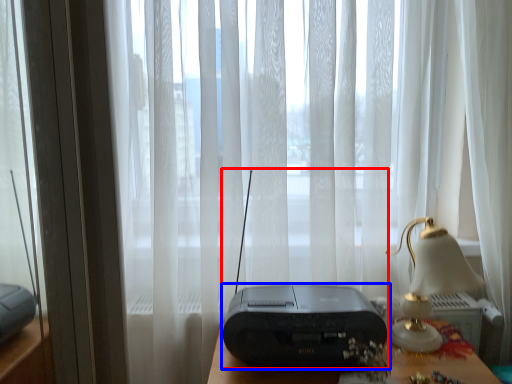
Question: Among these objects, which one is farthest to the camera, gadget (highlighted by a red box) or printer (highlighted by a blue box)?

Choices:
 (A) gadget
 (B) printer

Answer: (B)